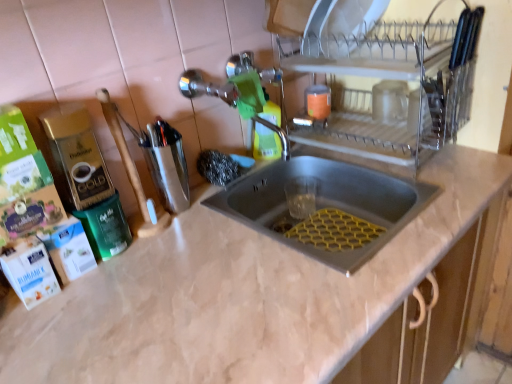
Identify the location of vacant area that is in front of metallic silver utensil holder at center-left, placed as the first appliance when sorted from left to right. (203, 242).